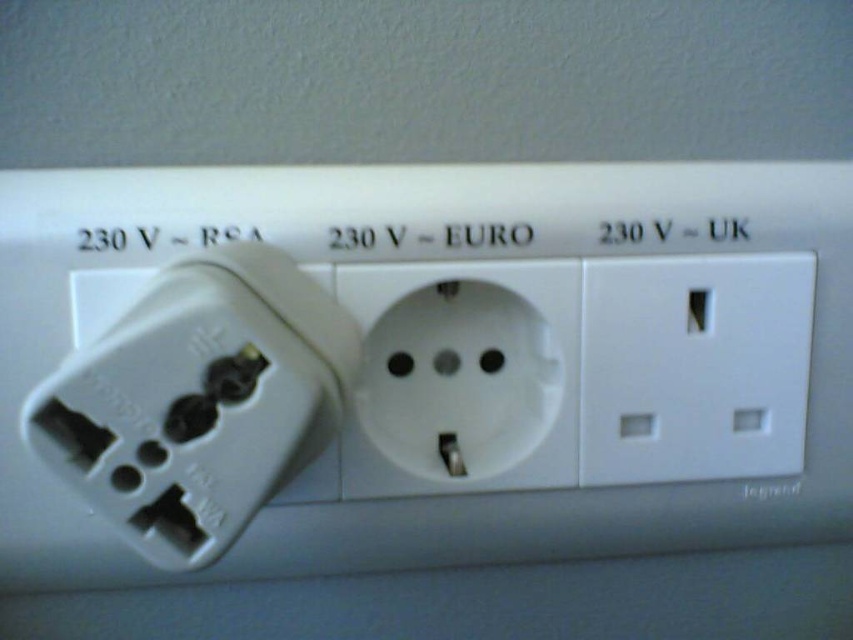
Question: From the image, what is the correct spatial relationship of white plastic socket at center in relation to white plastic socket at right?

Choices:
 (A) below
 (B) above

Answer: (A)

Question: Among these points, which one is farthest from the camera?

Choices:
 (A) (39, 435)
 (B) (529, 376)
 (C) (724, 333)

Answer: (B)

Question: Does white plastic socket at center have a larger size compared to white plastic socket at right?

Choices:
 (A) yes
 (B) no

Answer: (A)

Question: Is white plastic socket at center to the left of white plastic socket at right from the viewer's perspective?

Choices:
 (A) yes
 (B) no

Answer: (A)

Question: Which of the following is the closest to the observer?

Choices:
 (A) white plastic socket at right
 (B) white plastic plug at center

Answer: (B)

Question: Which object is the farthest from the white plastic socket at center?

Choices:
 (A) white plastic plug at center
 (B) white plastic socket at right

Answer: (A)